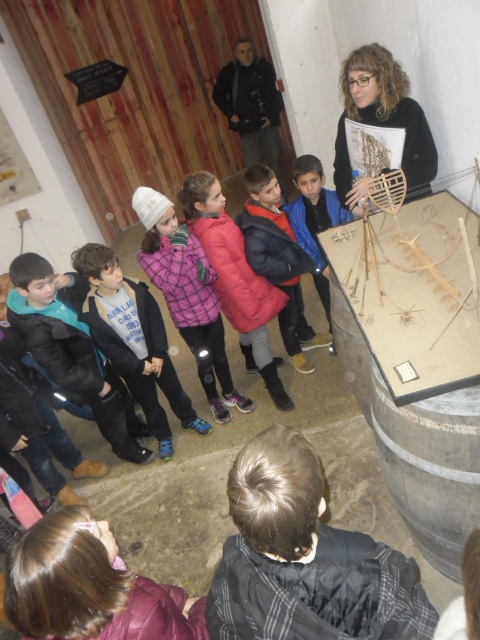
Between black fuzzy jacket at lower center and plaid fleece jacket at center, which one has less height?

With less height is black fuzzy jacket at lower center.

Does black fuzzy jacket at lower center have a greater width compared to plaid fleece jacket at center?

In fact, black fuzzy jacket at lower center might be narrower than plaid fleece jacket at center.

Identify the location of black fuzzy jacket at lower center. (304, 560).

At what (x,y) coordinates should I click in order to perform the action: click on black fuzzy jacket at lower center. Please return your answer as a coordinate pair (x, y). Looking at the image, I should click on (304, 560).

Is teal fleece jacket at lower left further to camera compared to wooden ship at upper right?

Yes, it is.

Is teal fleece jacket at lower left below wooden ship at upper right?

Yes.

Does point (82, 348) lie in front of point (422, 163)?

That is False.

Where is `teal fleece jacket at lower left`? This screenshot has width=480, height=640. teal fleece jacket at lower left is located at coordinates (72, 349).

Does point (119, 586) come closer to viewer compared to point (190, 420)?

Yes, it is.

Between point (38, 572) and point (130, 364), which one is positioned behind?

Positioned behind is point (130, 364).

Which is in front, point (119, 637) or point (165, 416)?

Point (119, 637) is more forward.

Find the location of a particular element. This screenshot has width=480, height=640. brown hair at lower left is located at coordinates (90, 588).